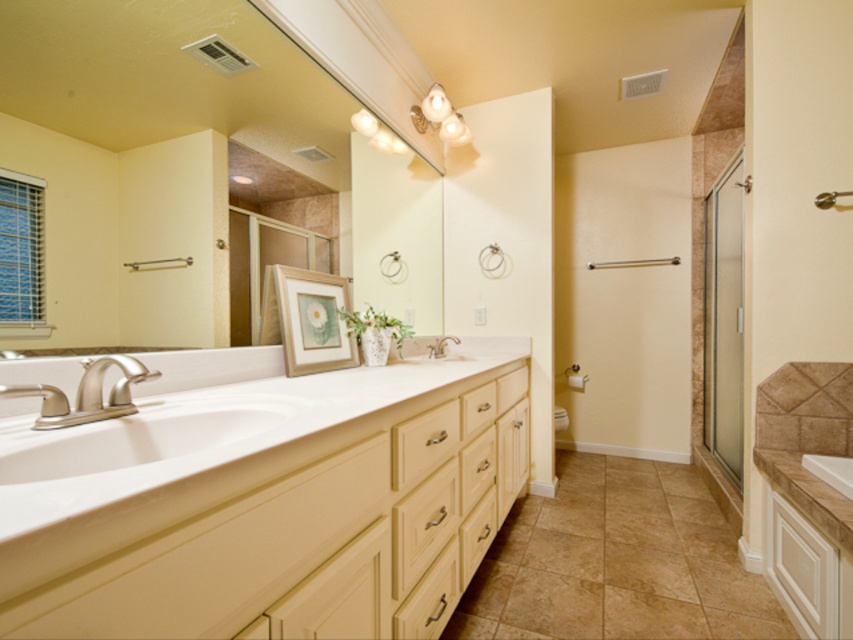
You are trying to place a new decorative item on the bathroom countertop. The item requires a space that is wider than the brushed nickel faucet at left. Can the white laminate countertop at center accommodate it?

The white laminate countertop at center might be wider than the brushed nickel faucet at left, so it could potentially accommodate the decorative item if the required width is met.

You are standing in the bathroom and want to hang a new picture frame exactly where the matte white mirror at upper center is currently located. Can you tell me the exact coordinates where the mirror is positioned?

The matte white mirror at upper center is positioned at coordinates point (149, 150).

You are standing in front of the bathroom and want to clean the white glossy sink at center and the brushed metal faucet at center. Which object should you clean first if you want to start with the one closer to you?

You should clean the white glossy sink at center first because it is closer to you than the brushed metal faucet at center.